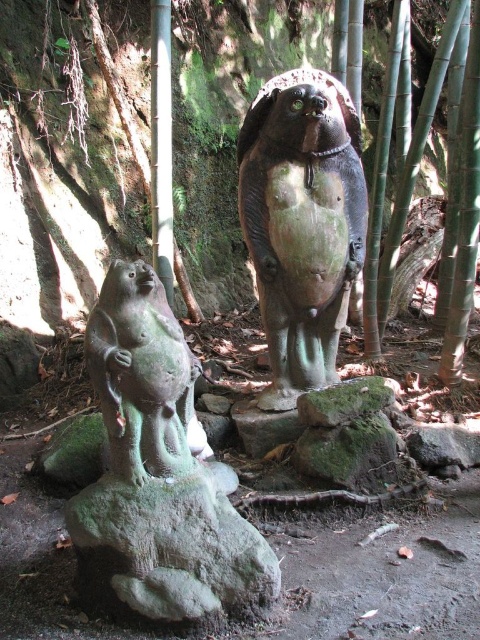
Is green stone monkey at center bigger than green mossy rock at center?

Yes.

Find the location of a particular element. green stone monkey at center is located at coordinates (157, 474).

Between point (124, 420) and point (361, 392), which one is positioned in front?

Point (124, 420) is more forward.

At what (x,y) coordinates should I click in order to perform the action: click on green stone monkey at center. Please return your answer as a coordinate pair (x, y). This screenshot has height=640, width=480. Looking at the image, I should click on (157, 474).

Does point (266, 554) lie in front of point (299, 188)?

Yes, it is.

You are a GUI agent. You are given a task and a screenshot of the screen. Output one action in this format:
    pyautogui.click(x=<x>, y=<y>)
    Task: Click on the green stone monkey at center
    The image size is (480, 640).
    Given the screenshot: What is the action you would take?
    pyautogui.click(x=157, y=474)

Consider the image. Does green stone monkey at lower left lie in front of green mossy rock at center?

That is True.

Who is taller, green stone monkey at lower left or green mossy rock at center?

With more height is green stone monkey at lower left.

Locate an element on the screen. The width and height of the screenshot is (480, 640). green stone monkey at lower left is located at coordinates (143, 376).